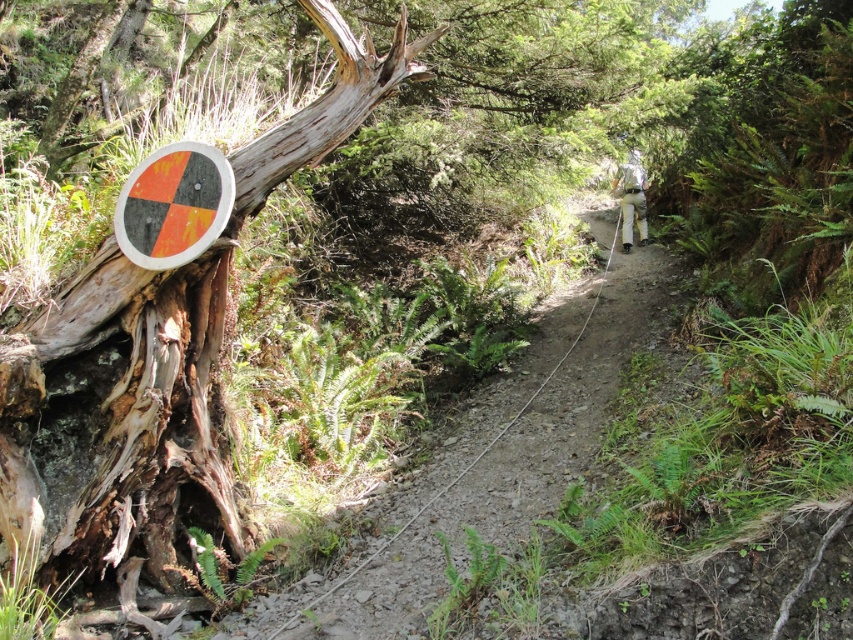
Does point (254, 636) lie behind point (123, 220)?

No.

From the picture: Who is higher up, dirt path at center or orange matte sign at left?

orange matte sign at left is above.

Locate an element on the screen. dirt path at center is located at coordinates (491, 456).

Measure the distance between weathered wood tree trunk at left and camera.

weathered wood tree trunk at left and camera are 3.62 meters apart.

Where is `weathered wood tree trunk at left`? The width and height of the screenshot is (853, 640). weathered wood tree trunk at left is located at coordinates (154, 364).

Is weathered wood tree trunk at left bigger than orange matte sign at left?

Yes.

Does point (27, 385) come in front of point (200, 195)?

Yes, point (27, 385) is closer to viewer.

The image size is (853, 640). What are the coordinates of `weathered wood tree trunk at left` in the screenshot? It's located at (154, 364).